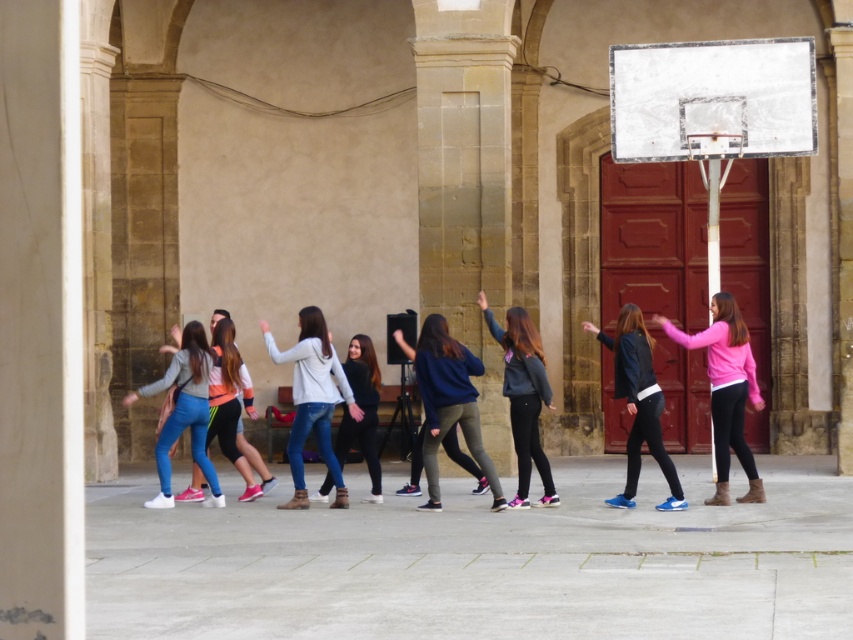
Question: Does light gray denim jeans at center appear over matte black jacket at center?

Choices:
 (A) yes
 (B) no

Answer: (A)

Question: Which object is farther from the camera taking this photo?

Choices:
 (A) denim jeans at center
 (B) jeans at center
 (C) blue denim jeans at left

Answer: (B)

Question: From the image, what is the correct spatial relationship of denim jeans at center in relation to pink matte sweater at center?

Choices:
 (A) right
 (B) left

Answer: (B)

Question: Can you confirm if pink matte sweater at center is positioned to the right of dark blue sweatshirt at center?

Choices:
 (A) yes
 (B) no

Answer: (A)

Question: Among these objects, which one is nearest to the camera?

Choices:
 (A) dark blue sweatshirt at center
 (B) jeans at center

Answer: (A)

Question: Which of these objects is positioned closest to the blue denim jeans at left?

Choices:
 (A) matte black jacket at center
 (B) denim jeans at center

Answer: (A)